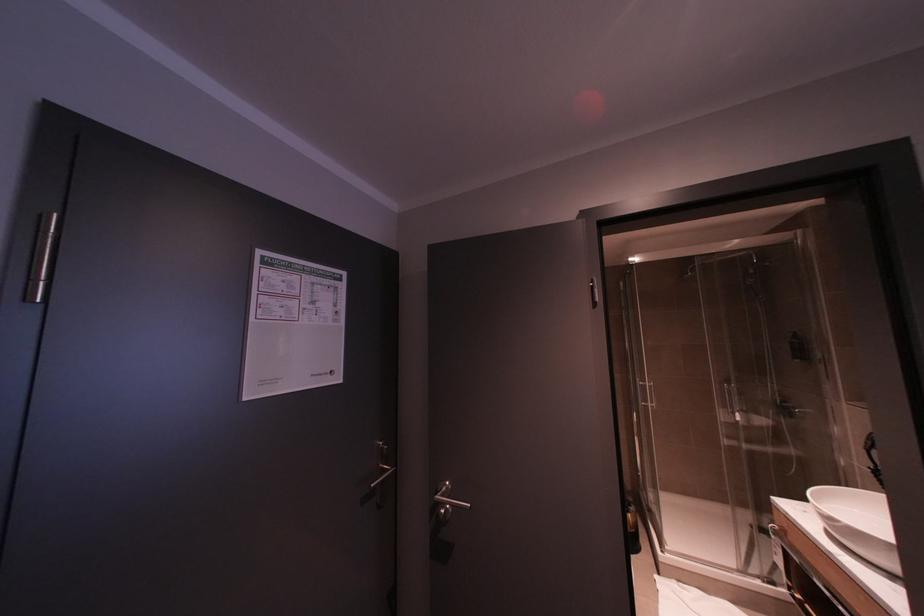
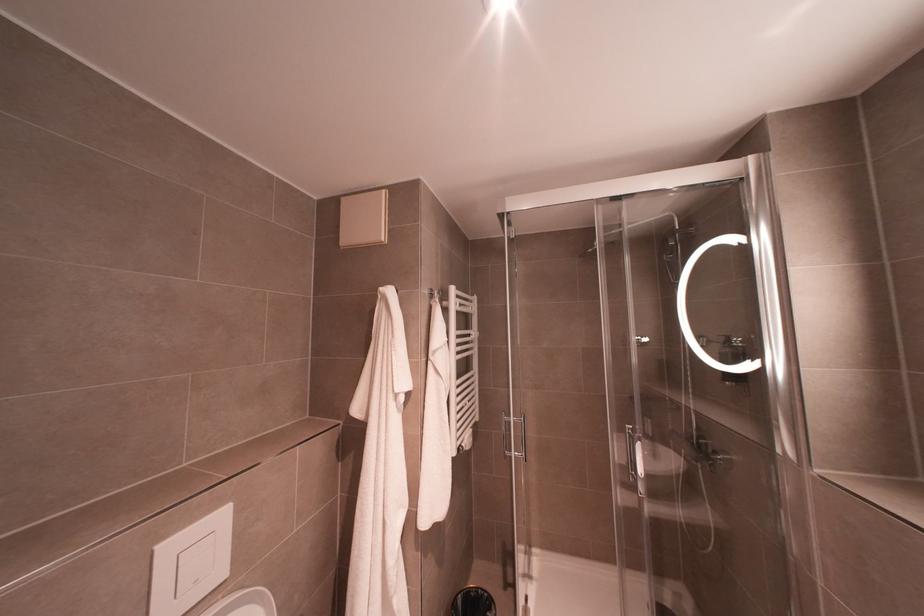
In the second image, find the point that corresponds to (x=645, y=400) in the first image.

(511, 451)